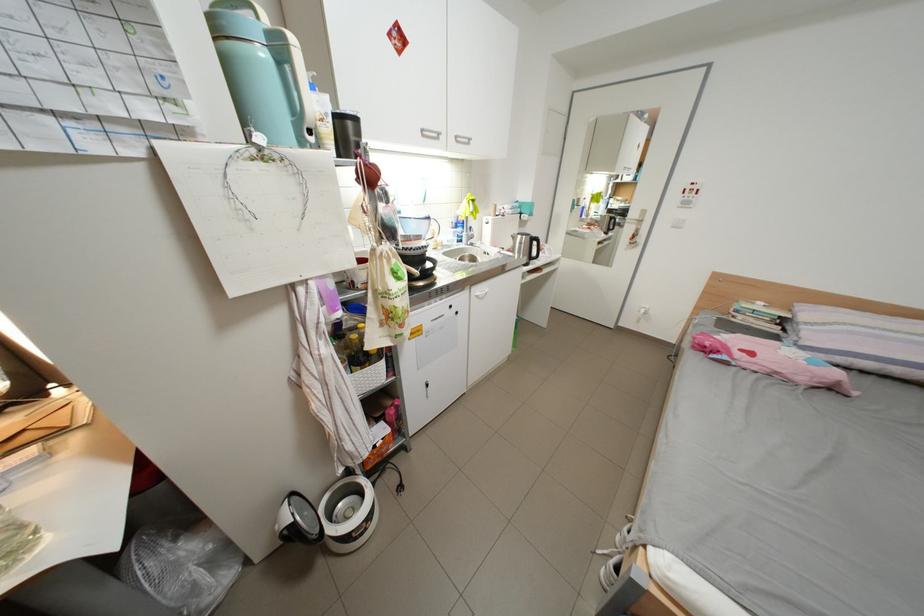
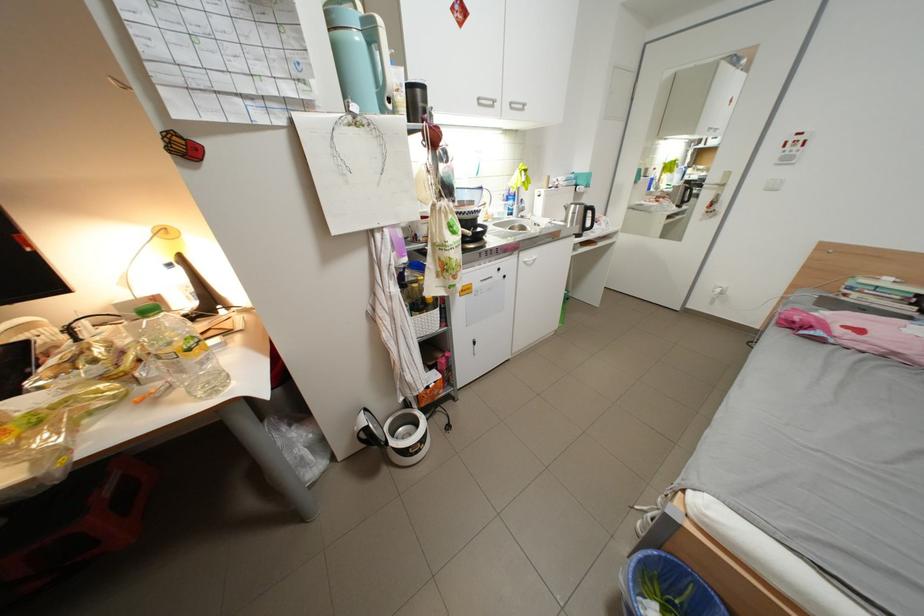
Where in the second image is the point corresponding to pixel 751 318 from the first image?

(867, 296)